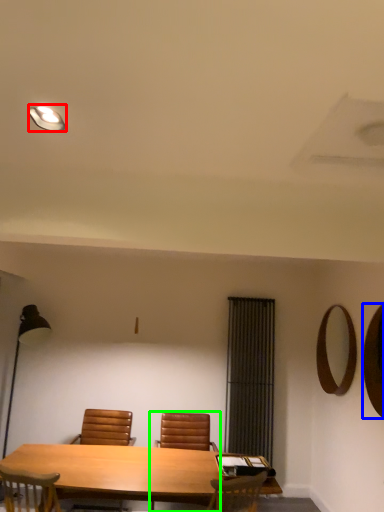
Question: Which object is positioned farthest from lighting (highlighted by a red box)? Select from mirror (highlighted by a blue box) and chair (highlighted by a green box).

Choices:
 (A) mirror
 (B) chair

Answer: (B)